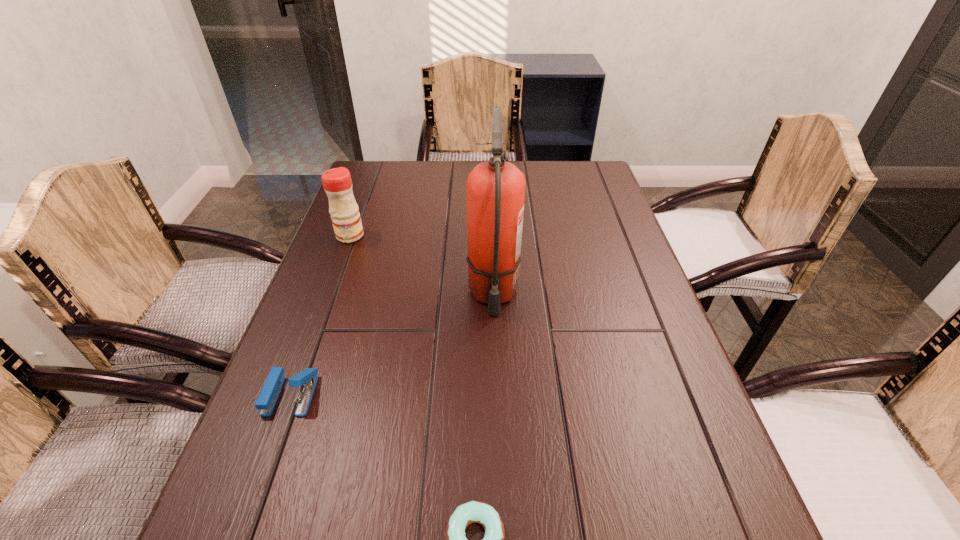
Where is `object that stands as the closest to the stapler`? The image size is (960, 540). object that stands as the closest to the stapler is located at coordinates (470, 512).